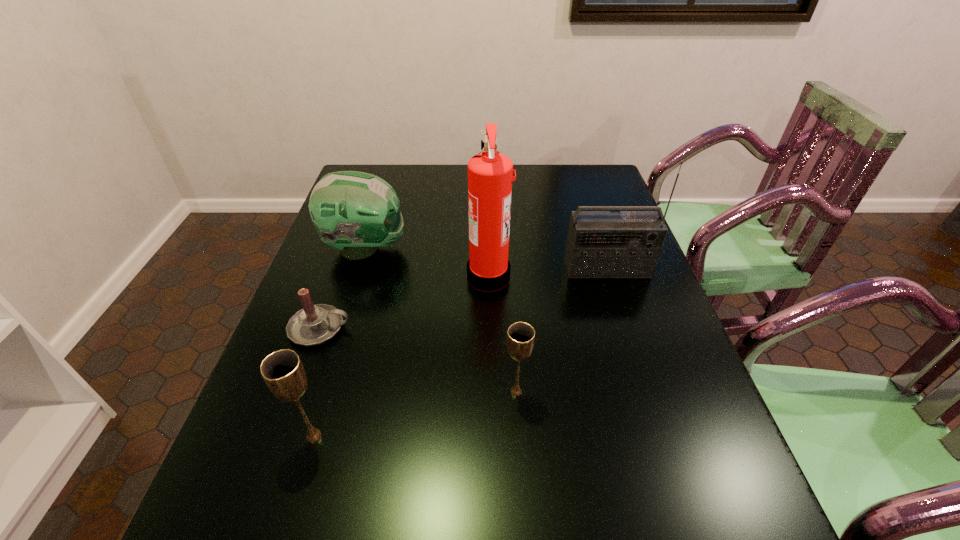
Locate an element on the screen. blank region between the nearer chalice and the shortest object is located at coordinates (317, 382).

You are a GUI agent. You are given a task and a screenshot of the screen. Output one action in this format:
    pyautogui.click(x=<x>, y=<y>)
    Task: Click on the free spot between the tallest object and the taller chalice
    
    Given the screenshot: What is the action you would take?
    point(401,356)

Identify the location of free space between the tallest object and the fourth farthest object. (404, 302).

Find the location of `unoccupied position between the football helmet and the fourth farthest object`. unoccupied position between the football helmet and the fourth farthest object is located at coordinates (343, 288).

Find the location of a particular element. This screenshot has width=960, height=540. free space between the right chalice and the football helmet is located at coordinates pos(441,320).

The image size is (960, 540). I want to click on blank region between the fifth farthest object and the tallest object, so click(x=502, y=333).

Locate an element on the screen. The height and width of the screenshot is (540, 960). free space between the football helmet and the second nearest object is located at coordinates (441, 320).

This screenshot has height=540, width=960. I want to click on vacant area between the second nearest object and the nearer chalice, so click(x=415, y=414).

The width and height of the screenshot is (960, 540). In order to click on vacant area that lies between the fire extinguisher and the fourth farthest object in this screenshot , I will do `click(404, 302)`.

Identify which object is located as the third nearest to the football helmet. Please provide its 2D coordinates. Your answer should be formatted as a tuple, i.e. [(x, y)], where the tuple contains the x and y coordinates of a point satisfying the conditions above.

[(601, 244)]